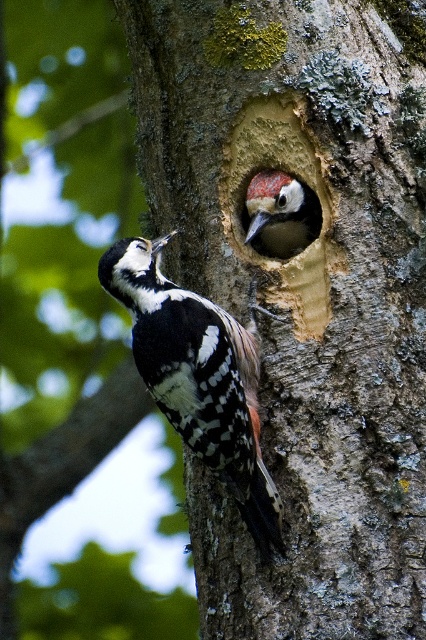
Between white speckled woodpecker at left and speckled brown woodpecker at center, which one has more height?

white speckled woodpecker at left is taller.

Looking at this image, can you confirm if white speckled woodpecker at left is bigger than speckled brown woodpecker at center?

Yes, white speckled woodpecker at left is bigger than speckled brown woodpecker at center.

Is point (244, 486) positioned after point (271, 189)?

No, (244, 486) is closer to viewer.

Where is `white speckled woodpecker at left`? The width and height of the screenshot is (426, 640). white speckled woodpecker at left is located at coordinates (198, 378).